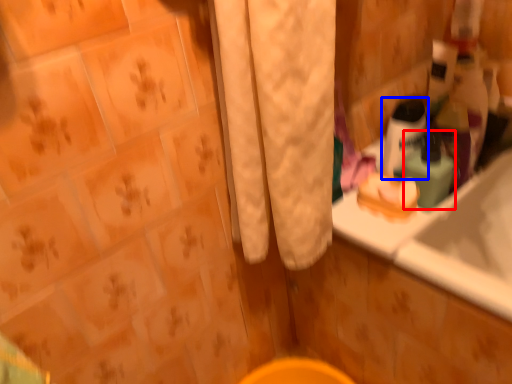
Question: Which of the following is the closest to the observer, mouthwash (highlighted by a red box) or mouthwash (highlighted by a blue box)?

Choices:
 (A) mouthwash
 (B) mouthwash

Answer: (A)